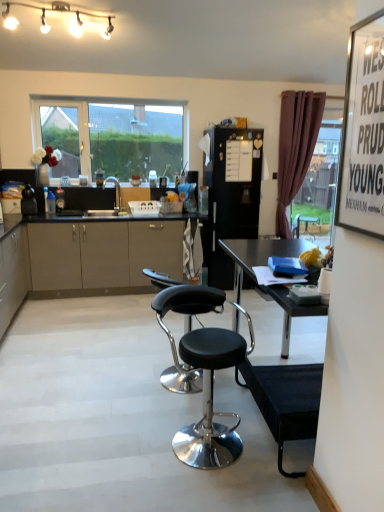
Image resolution: width=384 pixels, height=512 pixels. Describe the element at coordinates (181, 297) in the screenshot. I see `black leather stool at center, positioned as the 1th chair in back-to-front order` at that location.

The image size is (384, 512). I want to click on black leather stool at center, positioned as the 1th chair in back-to-front order, so (181, 297).

The image size is (384, 512). Describe the element at coordinates (286, 401) in the screenshot. I see `black plastic table at center` at that location.

Image resolution: width=384 pixels, height=512 pixels. I want to click on purple velvet curtain at right, so click(295, 147).

This screenshot has width=384, height=512. What are the coordinates of `black plastic camera at left, acting as the second appliance starting from the back` in the screenshot? It's located at point(28,201).

How much distance is there between black leather stool at center, the 2th chair viewed from the back, and clear glass window at upper center?

10.29 feet.

How many degrees apart are the facing directions of black leather stool at center, the 2th chair viewed from the back, and clear glass window at upper center?

The angular difference between black leather stool at center, the 2th chair viewed from the back, and clear glass window at upper center is 0.492 degrees.

Who is shorter, black leather stool at center, the 2th chair viewed from the back, or clear glass window at upper center?

With less height is black leather stool at center, the 2th chair viewed from the back.

From the image's perspective, which is below, black leather stool at center, which is the first chair in front-to-back order, or clear glass window at upper center?

From the image's view, black leather stool at center, which is the first chair in front-to-back order, is below.

From the picture: Is the surface of black plastic table at center in direct contact with purple velvet curtain at right?

No, black plastic table at center is not in contact with purple velvet curtain at right.

Considering the sizes of black plastic table at center and purple velvet curtain at right in the image, is black plastic table at center wider or thinner than purple velvet curtain at right?

Clearly, black plastic table at center has more width compared to purple velvet curtain at right.

Can you confirm if black plastic table at center is taller than purple velvet curtain at right?

No.

Is black plastic table at center further to camera compared to purple velvet curtain at right?

That is False.

Is black leather stool at center, the 2th chair viewed from the back, wider or thinner than white paperboard at upper right?

Clearly, black leather stool at center, the 2th chair viewed from the back, has more width compared to white paperboard at upper right.

Where is `bulletin board in front of the black leather stool at center, the 2th chair viewed from the back`? This screenshot has height=512, width=384. bulletin board in front of the black leather stool at center, the 2th chair viewed from the back is located at coordinates (363, 132).

Considering the relative positions of black leather stool at center, the 2th chair viewed from the back, and white paperboard at upper right in the image provided, is black leather stool at center, the 2th chair viewed from the back, to the left of white paperboard at upper right from the viewer's perspective?

Yes, black leather stool at center, the 2th chair viewed from the back, is to the left of white paperboard at upper right.

From the image's perspective, which is below, black matte refrigerator at center, the first appliance when ordered from right to left, or clear glass window at upper center?

black matte refrigerator at center, the first appliance when ordered from right to left.

Is clear glass window at upper center located within black matte refrigerator at center, which appears as the first appliance when viewed from the back?

That's incorrect, clear glass window at upper center is not inside black matte refrigerator at center, which appears as the first appliance when viewed from the back.

Is black matte refrigerator at center, the second appliance when ordered from front to back, oriented towards clear glass window at upper center?

No, black matte refrigerator at center, the second appliance when ordered from front to back, is not turned towards clear glass window at upper center.

Starting from the black plastic camera at left, which appears as the second appliance when viewed from the right, which chair is the 1st one in front? Please provide its 2D coordinates.

[(181, 297)]

Is the surface of black leather stool at center, the 2th chair viewed from the front, in direct contact with black plastic camera at left, which is counted as the 1th appliance, starting from the left?

No, black leather stool at center, the 2th chair viewed from the front, is not in contact with black plastic camera at left, which is counted as the 1th appliance, starting from the left.

Measure the distance from black leather stool at center, the 2th chair viewed from the front, to black plastic camera at left, which is counted as the 1th appliance, starting from the left.

The distance of black leather stool at center, the 2th chair viewed from the front, from black plastic camera at left, which is counted as the 1th appliance, starting from the left, is 8.81 feet.

Is point (258, 247) farther from viewer compared to point (201, 442)?

Yes, it is behind point (201, 442).

From the image's perspective, is black plastic table at center above or below black leather stool at center, the 2th chair viewed from the back?

From the image's perspective, black plastic table at center appears above black leather stool at center, the 2th chair viewed from the back.

Consider the image. Looking at the image, does black plastic table at center seem bigger or smaller compared to black leather stool at center, which is the first chair in front-to-back order?

In the image, black plastic table at center appears to be larger than black leather stool at center, which is the first chair in front-to-back order.

Is black plastic table at center inside the boundaries of black leather stool at center, the 2th chair viewed from the back, or outside?

The correct answer is: outside.

Considering the sizes of objects black plastic table at center and plastic basket at center in the image provided, who is smaller, black plastic table at center or plastic basket at center?

Smaller between the two is plastic basket at center.

Is black plastic table at center outside of plastic basket at center?

Indeed, black plastic table at center is completely outside plastic basket at center.

From the image's perspective, would you say black plastic table at center is shown under plastic basket at center?

Yes.

Can you tell me how much black plastic table at center and plastic basket at center differ in facing direction?

They differ by 87.9 degrees in their facing directions.

At what (x,y) coordinates should I click in order to perform the action: click on the 2nd chair below when counting from the clear glass window at upper center (from the image's perspective). Please return your answer as a coordinate pair (x, y). Looking at the image, I should click on (205, 374).

You are a GUI agent. You are given a task and a screenshot of the screen. Output one action in this format:
    pyautogui.click(x=<x>, y=<y>)
    Task: Click on the curtain located above the black plastic table at center (from a real-world perspective)
    This screenshot has width=384, height=512.
    Given the screenshot: What is the action you would take?
    pyautogui.click(x=295, y=147)

When comparing their distances from purple velvet curtain at right, does black plastic table at center or white paperboard at upper right seem closer?

black plastic table at center is closer to purple velvet curtain at right.

Estimate the real-world distances between objects in this image. Which object is closer to black plastic table at center, black plastic camera at left, which is counted as the 1th appliance, starting from the left, or white paperboard at upper right?

white paperboard at upper right lies closer to black plastic table at center than the other object.

When comparing their distances from white glossy string lights at upper center, does purple velvet curtain at right or black plastic camera at left, arranged as the 1th appliance when viewed from the front, seem closer?

black plastic camera at left, arranged as the 1th appliance when viewed from the front, is closer to white glossy string lights at upper center.

Estimate the real-world distances between objects in this image. Which object is further from black leather stool at center, which is the first chair in front-to-back order, black matte refrigerator at center, the first appliance when ordered from right to left, or matte beige cabinet at lower left?

black matte refrigerator at center, the first appliance when ordered from right to left, is further to black leather stool at center, which is the first chair in front-to-back order.

Estimate the real-world distances between objects in this image. Which object is closer to black plastic table at center, black matte refrigerator at center, which appears as the first appliance when viewed from the back, or clear glass window at upper center?

The object closer to black plastic table at center is black matte refrigerator at center, which appears as the first appliance when viewed from the back.

When comparing their distances from white glossy string lights at upper center, does black plastic camera at left, which is counted as the 1th appliance, starting from the left, or purple velvet curtain at right seem further?

purple velvet curtain at right is further to white glossy string lights at upper center.

Estimate the real-world distances between objects in this image. Which object is closer to white paperboard at upper right, white glossy string lights at upper center or black matte refrigerator at center, which appears as the first appliance when viewed from the back?

white glossy string lights at upper center is closer to white paperboard at upper right.

When comparing their distances from purple velvet curtain at right, does plastic basket at center or black plastic table at center seem further?

black plastic table at center lies further to purple velvet curtain at right than the other object.

I want to click on picnic basket situated between white glossy string lights at upper center and purple velvet curtain at right from left to right, so click(144, 208).

You are a GUI agent. You are given a task and a screenshot of the screen. Output one action in this format:
    pyautogui.click(x=<x>, y=<y>)
    Task: Click on the picnic basket situated between clear glass window at upper center and black matte refrigerator at center, the first appliance when ordered from right to left, from left to right
    The height and width of the screenshot is (512, 384).
    Given the screenshot: What is the action you would take?
    pyautogui.click(x=144, y=208)

This screenshot has height=512, width=384. Find the location of `appliance between black plastic table at center and black matte refrigerator at center, the second appliance when ordered from front to back, in the front-back direction`. appliance between black plastic table at center and black matte refrigerator at center, the second appliance when ordered from front to back, in the front-back direction is located at coordinates (28, 201).

This screenshot has width=384, height=512. Find the location of `lamp between black plastic table at center and black plastic camera at left, arranged as the 1th appliance when viewed from the front, from front to back`. lamp between black plastic table at center and black plastic camera at left, arranged as the 1th appliance when viewed from the front, from front to back is located at coordinates (58, 12).